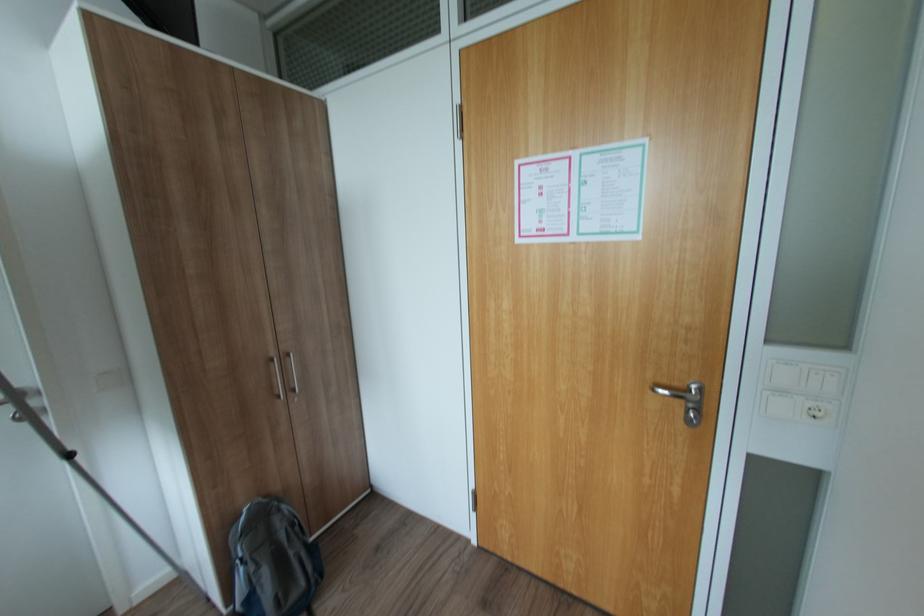
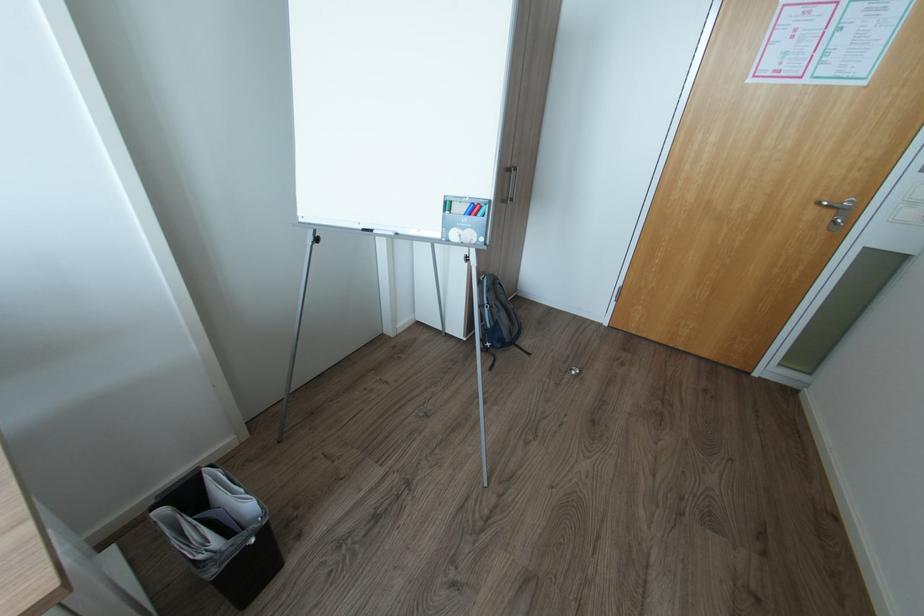
Find the pixel in the second image that matches [695,415] in the first image.

(845, 221)